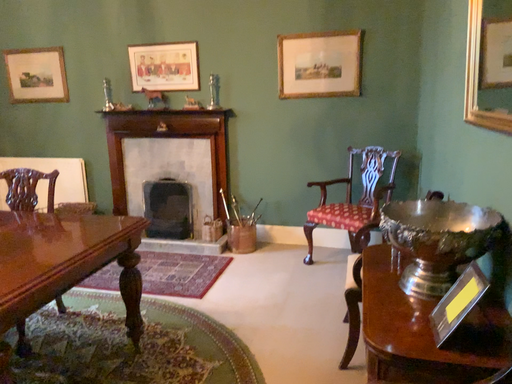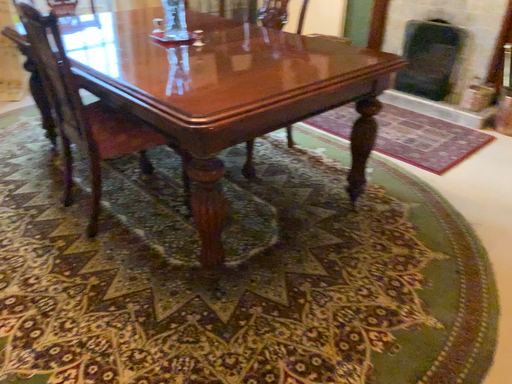
Question: How did the camera likely rotate when shooting the video?

Choices:
 (A) rotated right
 (B) rotated left

Answer: (B)